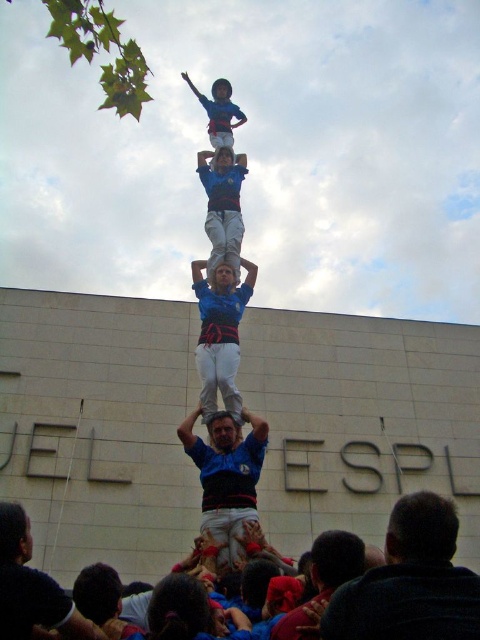
You are a photographer standing in front of the human tower. You want to capture a photo of the dark brown hair at lower right and the blue fabric man at center. Which one is positioned to the right side of the other?

The dark brown hair at lower right is to the right of the blue fabric man at center.

You are standing at the base of the human tower in the image. Looking upward, you notice a point marked at coordinates (227, 477). Which person in the tower does this point correspond to?

The point at coordinates (227, 477) corresponds to the blue fabric man at center.